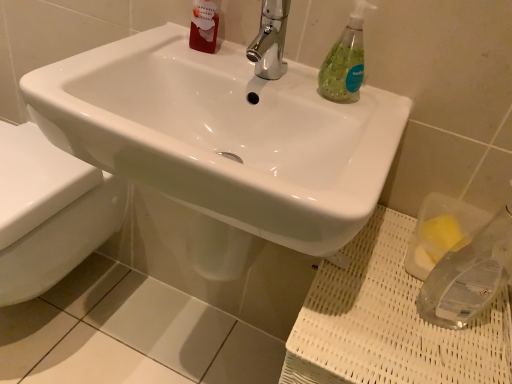
Find the location of `free point above clear plastic sponge at lower right (from a real-world perspective)`. free point above clear plastic sponge at lower right (from a real-world perspective) is located at coordinates (390, 307).